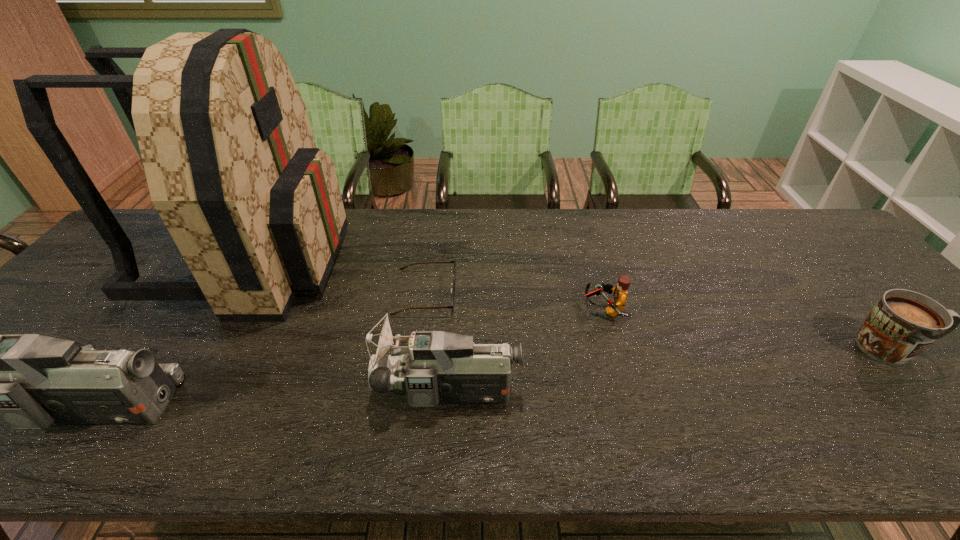
At what (x,y) coordinates should I click in order to perform the action: click on the third tallest object. Please return your answer as a coordinate pair (x, y). This screenshot has height=540, width=960. Looking at the image, I should click on (440, 367).

Find the location of a particular element. This screenshot has height=540, width=960. the right camcorder is located at coordinates (440, 367).

This screenshot has width=960, height=540. Find the location of `backpack`. backpack is located at coordinates (255, 209).

This screenshot has width=960, height=540. I want to click on Lego, so click(620, 293).

Locate an element on the screen. The width and height of the screenshot is (960, 540). the shortest object is located at coordinates (402, 268).

In order to click on the rightmost object in this screenshot , I will do `click(902, 324)`.

The width and height of the screenshot is (960, 540). What are the coordinates of `vacant space located 0.370m on the front-facing side of the right camcorder` in the screenshot? It's located at (207, 392).

The width and height of the screenshot is (960, 540). What are the coordinates of `free space located on the front-facing side of the right camcorder` in the screenshot? It's located at (303, 392).

The height and width of the screenshot is (540, 960). I want to click on vacant space located on the front-facing side of the right camcorder, so click(239, 392).

Identify the location of free location located on the front face of the tallest object. Image resolution: width=960 pixels, height=540 pixels. (473, 260).